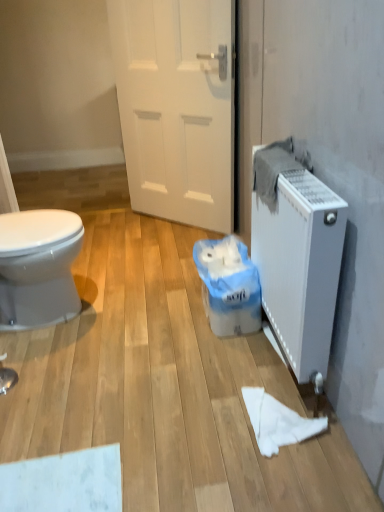
Measure the distance between white plastic bag at center and camera.

white plastic bag at center and camera are 1.64 meters apart.

Image resolution: width=384 pixels, height=512 pixels. I want to click on white matte radiator at right, so [x=300, y=266].

Identify the location of white plastic bag at center. (229, 286).

From their relative heights in the image, would you say white matte radiator at right is taller or shorter than white paper towel at lower center?

In the image, white matte radiator at right appears to be taller than white paper towel at lower center.

Is white paper towel at lower center surrounded by white matte radiator at right?

That's incorrect, white paper towel at lower center is not inside white matte radiator at right.

From the picture: Is white matte radiator at right thinner than white paper towel at lower center?

Yes.

Looking at this image, considering the sizes of objects white matte radiator at right and white paper towel at lower center in the image provided, who is bigger, white matte radiator at right or white paper towel at lower center?

Bigger between the two is white matte radiator at right.

Locate an element on the screen. This screenshot has height=512, width=384. radiator in front of the white matte door at center is located at coordinates (300, 266).

In the scene shown: What's the angular difference between white matte radiator at right and white matte door at center's facing directions?

47.5 degrees separate the facing orientations of white matte radiator at right and white matte door at center.

Which object is closer to the camera taking this photo, white matte radiator at right or white matte door at center?

white matte radiator at right is closer to the camera.

Can we say white matte radiator at right lies outside white matte door at center?

That's correct, white matte radiator at right is outside of white matte door at center.

Is the position of white plastic bag at center less distant than that of white matte door at center?

Yes, it is.

Is white plastic bag at center bigger than white matte door at center?

Actually, white plastic bag at center might be smaller than white matte door at center.

Is white plastic bag at center wider or thinner than white matte door at center?

In the image, white plastic bag at center appears to be wider than white matte door at center.

Is the surface of white plastic bag at center in direct contact with white matte door at center?

white plastic bag at center and white matte door at center are clearly separated.

Identify the location of toilet paper that is on the right side of white matte door at center. (277, 422).

Looking at this image, is white matte door at center inside the boundaries of white paper towel at lower center, or outside?

white matte door at center is not enclosed by white paper towel at lower center.

In terms of height, does white matte door at center look taller or shorter compared to white paper towel at lower center?

white matte door at center is taller than white paper towel at lower center.

From the image's perspective, relative to white paper towel at lower center, is white matte door at center above or below?

Clearly, from the image's perspective, white matte door at center is above white paper towel at lower center.

Between point (230, 284) and point (337, 203), which one is positioned behind?

Point (230, 284)

In the image, is white plastic bag at center positioned in front of or behind white matte radiator at right?

Clearly, white plastic bag at center is behind white matte radiator at right.

Which of these two, white plastic bag at center or white matte radiator at right, stands taller?

With more height is white matte radiator at right.

Is white plastic bag at center bigger than white matte radiator at right?

Incorrect, white plastic bag at center is not larger than white matte radiator at right.

Consider the image. Is white matte radiator at right surrounded by white paper towel at lower center?

A: That's incorrect, white matte radiator at right is not inside white paper towel at lower center.

Which is closer to the camera, [255,431] or [257,205]?

The point [255,431] is closer to the camera.

From a real-world perspective, which object stands above the other?

From a 3D spatial view, white matte radiator at right is above.

From the picture: From the image's perspective, is white paper towel at lower center below white matte radiator at right?

Yes, from the image's perspective, white paper towel at lower center is beneath white matte radiator at right.

From the image's perspective, which is above, white paper towel at lower center or white matte door at center?

From the image's view, white matte door at center is above.

Between white paper towel at lower center and white matte door at center, which one has larger size?

white matte door at center.

Would you say white paper towel at lower center contains white matte door at center?

No, white matte door at center is located outside of white paper towel at lower center.

I want to click on toilet paper located on the left of white matte radiator at right, so click(277, 422).

Find the location of `door that is behind the white matte radiator at right`. door that is behind the white matte radiator at right is located at coordinates (177, 106).

Based on their spatial positions, is white paper towel at lower center or white matte door at center closer to white matte radiator at right?

white paper towel at lower center is positioned closer to the anchor white matte radiator at right.

Looking at the image, which one is located further to white plastic bag at center, white paper towel at lower center or white matte door at center?

Based on the image, white matte door at center appears to be further to white plastic bag at center.

Estimate the real-world distances between objects in this image. Which object is closer to white matte door at center, white plastic bag at center or white paper towel at lower center?

white plastic bag at center.

Which object lies further to the anchor point white matte radiator at right, white matte door at center or white plastic bag at center?

The object further to white matte radiator at right is white matte door at center.

Looking at the image, which one is located further to white matte door at center, white paper towel at lower center or white plastic bag at center?

Based on the image, white paper towel at lower center appears to be further to white matte door at center.

Looking at the image, which one is located further to white matte door at center, white matte radiator at right or white paper towel at lower center?

white paper towel at lower center is positioned further to the anchor white matte door at center.

From the image, which object appears to be nearer to white matte radiator at right, white plastic bag at center or white paper towel at lower center?

white plastic bag at center lies closer to white matte radiator at right than the other object.

Looking at the image, which one is located further to white plastic bag at center, white matte door at center or white paper towel at lower center?

white matte door at center lies further to white plastic bag at center than the other object.

This screenshot has height=512, width=384. In order to click on garbage between white matte door at center and white paper towel at lower center from top to bottom in this screenshot , I will do `click(229, 286)`.

Where is `radiator between white matte door at center and white plastic bag at center in the up-down direction`? Image resolution: width=384 pixels, height=512 pixels. radiator between white matte door at center and white plastic bag at center in the up-down direction is located at coordinates (300, 266).

This screenshot has height=512, width=384. Identify the location of toilet paper between white matte radiator at right and white plastic bag at center along the z-axis. (277, 422).

This screenshot has height=512, width=384. Identify the location of radiator between white matte door at center and white paper towel at lower center in the up-down direction. (300, 266).